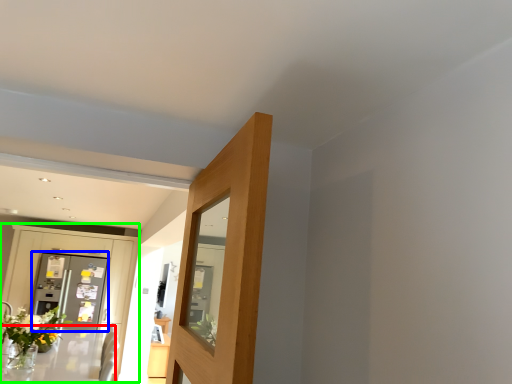
Question: Which object is positioned farthest from table (highlighted by a red box)? Select from screen door (highlighted by a blue box) and dresser (highlighted by a green box).

Choices:
 (A) screen door
 (B) dresser

Answer: (B)